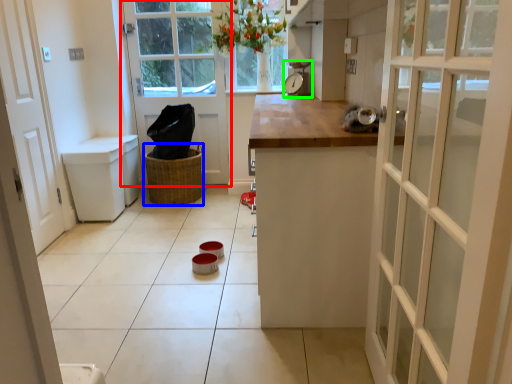
Question: Which is farther away from door (highlighted by a red box)? basket (highlighted by a blue box) or appliance (highlighted by a green box)?

Choices:
 (A) basket
 (B) appliance

Answer: (B)